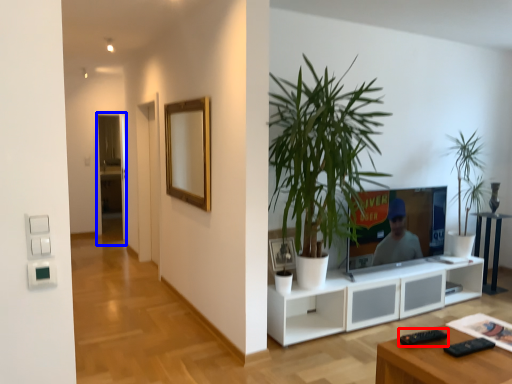
Question: Which point is further to the camera, remote (highlighted by a red box) or glass door (highlighted by a blue box)?

Choices:
 (A) remote
 (B) glass door

Answer: (B)